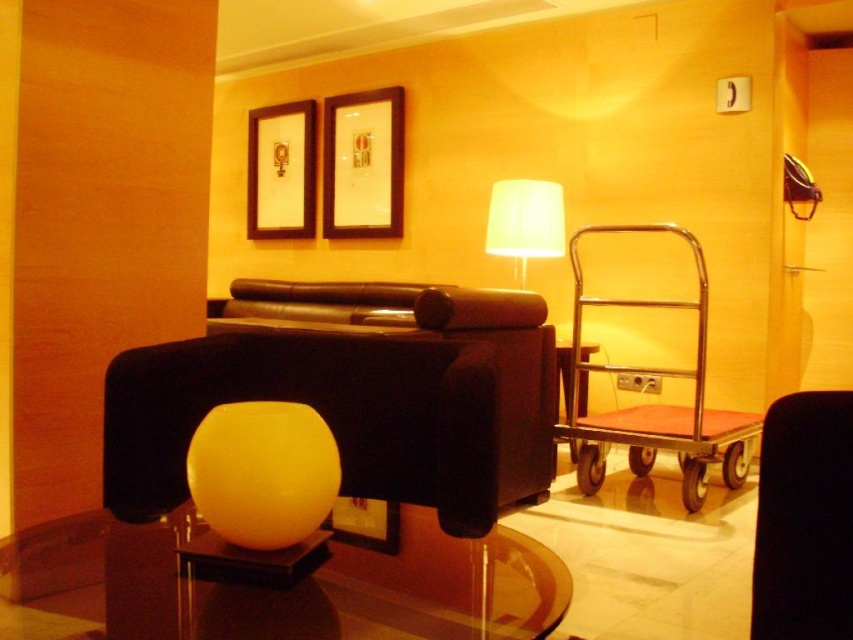
Question: Based on their relative distances, which object is farther from the black fabric armchair at right?

Choices:
 (A) transparent glass table at center
 (B) metallic red cart at right
 (C) white fabric lampshade at upper center

Answer: (C)

Question: Can you confirm if transparent glass table at center is smaller than white fabric lampshade at upper center?

Choices:
 (A) yes
 (B) no

Answer: (A)

Question: In this image, where is transparent glass table at center located relative to black fabric armchair at right?

Choices:
 (A) below
 (B) above

Answer: (B)

Question: Is black fabric armchair at right thinner than wooden picture frame at upper center?

Choices:
 (A) yes
 (B) no

Answer: (A)

Question: Among these objects, which one is nearest to the camera?

Choices:
 (A) matte black picture frame at upper center
 (B) white fabric lampshade at upper center

Answer: (B)

Question: Which point is farther to the camera?

Choices:
 (A) black fabric armchair at right
 (B) matte black picture frame at upper center
 (C) wooden picture frame at upper center
 (D) transparent glass table at center

Answer: (C)